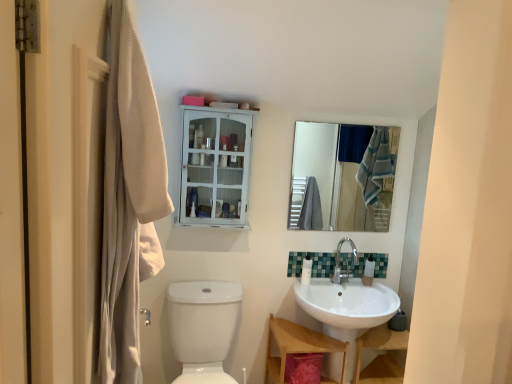
Question: Does white glossy toilet bowl at lower left contain wooden vanity at lower center?

Choices:
 (A) no
 (B) yes

Answer: (A)

Question: Can you confirm if white glossy toilet bowl at lower left is taller than wooden vanity at lower center?

Choices:
 (A) yes
 (B) no

Answer: (A)

Question: From a real-world perspective, is white glossy toilet bowl at lower left located beneath wooden vanity at lower center?

Choices:
 (A) yes
 (B) no

Answer: (B)

Question: Is white glossy toilet bowl at lower left behind wooden vanity at lower center?

Choices:
 (A) yes
 (B) no

Answer: (B)

Question: Is white glossy toilet bowl at lower left smaller than wooden vanity at lower center?

Choices:
 (A) yes
 (B) no

Answer: (B)

Question: Does white glossy toilet bowl at lower left turn towards wooden vanity at lower center?

Choices:
 (A) yes
 (B) no

Answer: (B)

Question: Can you confirm if white glossy bottle at lower center, marked as the first toiletry in a left-to-right arrangement, is wider than silver metallic faucet at center?

Choices:
 (A) yes
 (B) no

Answer: (B)

Question: Is white glossy bottle at lower center, marked as the first toiletry in a left-to-right arrangement, touching silver metallic faucet at center?

Choices:
 (A) no
 (B) yes

Answer: (A)

Question: Considering the relative sizes of white glossy bottle at lower center, marked as the first toiletry in a left-to-right arrangement, and silver metallic faucet at center in the image provided, is white glossy bottle at lower center, marked as the first toiletry in a left-to-right arrangement, taller than silver metallic faucet at center?

Choices:
 (A) no
 (B) yes

Answer: (A)

Question: From a real-world perspective, is white glossy bottle at lower center, the second toiletry when ordered from right to left, on top of silver metallic faucet at center?

Choices:
 (A) yes
 (B) no

Answer: (B)

Question: Is white glossy bottle at lower center, marked as the first toiletry in a left-to-right arrangement, far from silver metallic faucet at center?

Choices:
 (A) yes
 (B) no

Answer: (B)

Question: Is white glossy bottle at lower center, the second toiletry when ordered from right to left, not inside silver metallic faucet at center?

Choices:
 (A) yes
 (B) no

Answer: (A)

Question: Is silver metallic faucet at center surrounding white glossy sink at lower right?

Choices:
 (A) no
 (B) yes

Answer: (A)